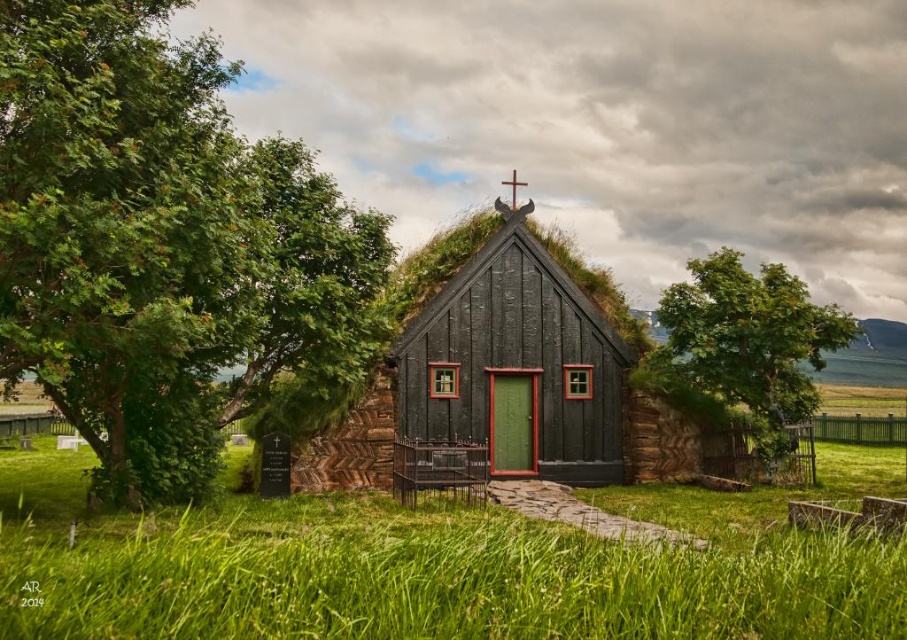
Question: Among these points, which one is farthest from the camera?

Choices:
 (A) (822, 305)
 (B) (216, 228)
 (C) (524, 381)

Answer: (A)

Question: From the image, what is the correct spatial relationship of matte black wooden cottage at center in relation to green leafy tree at right?

Choices:
 (A) right
 (B) left

Answer: (B)

Question: Among these objects, which one is farthest from the camera?

Choices:
 (A) green grass at center
 (B) matte black wooden cottage at center
 (C) green leafy tree at left
 (D) green leafy tree at right

Answer: (D)

Question: Does green leafy tree at left have a greater width compared to green grass at center?

Choices:
 (A) yes
 (B) no

Answer: (B)

Question: Is matte black wooden cottage at center bigger than green leafy tree at right?

Choices:
 (A) no
 (B) yes

Answer: (B)

Question: Which point is closer to the camera taking this photo?

Choices:
 (A) (469, 291)
 (B) (100, 429)
 (C) (783, 285)

Answer: (B)